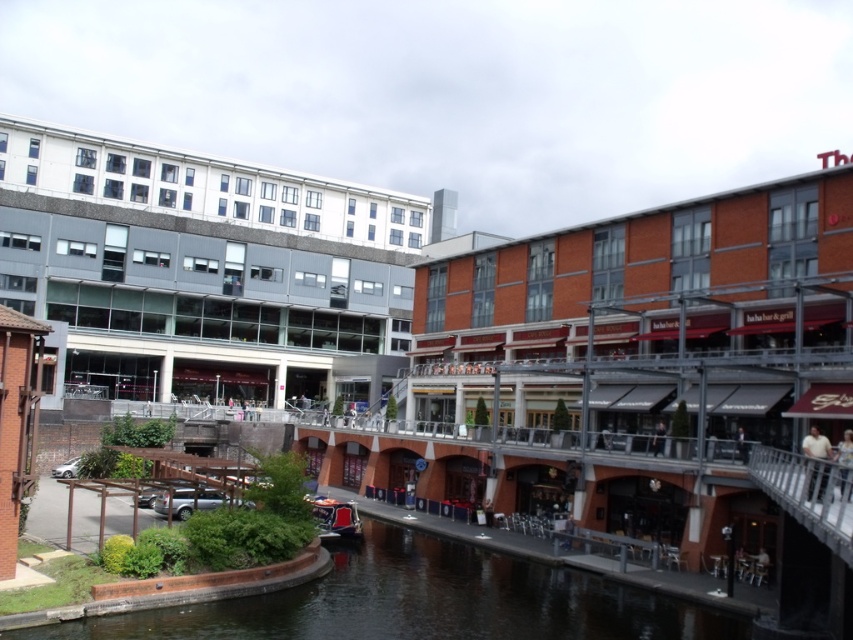
Who is lower down, smooth concrete river at center or metallic red boat at center?

smooth concrete river at center is below.

Which is more to the right, smooth concrete river at center or metallic red boat at center?

Positioned to the right is smooth concrete river at center.

Is point (227, 636) positioned behind point (316, 524)?

No.

You are a GUI agent. You are given a task and a screenshot of the screen. Output one action in this format:
    pyautogui.click(x=<x>, y=<y>)
    Task: Click on the smooth concrete river at center
    The width and height of the screenshot is (853, 640).
    Given the screenshot: What is the action you would take?
    pyautogui.click(x=426, y=602)